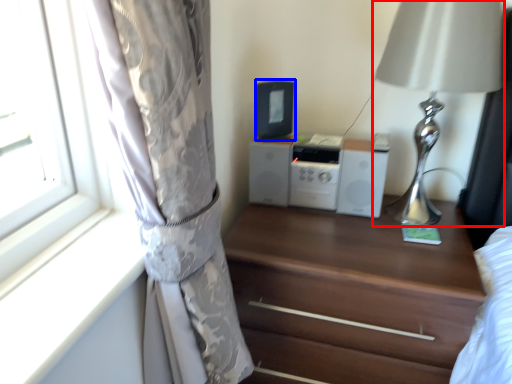
Question: Which object appears closest to the camera in this image, table lamp (highlighted by a red box) or appliance (highlighted by a blue box)?

Choices:
 (A) table lamp
 (B) appliance

Answer: (A)